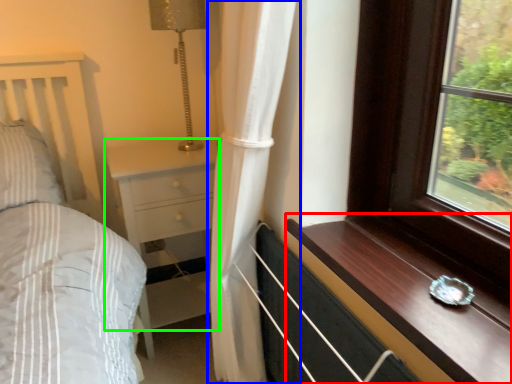
Question: Considering the real-world distances, which object is farthest from window sill (highlighted by a red box)? curtain (highlighted by a blue box) or chest of drawers (highlighted by a green box)?

Choices:
 (A) curtain
 (B) chest of drawers

Answer: (B)